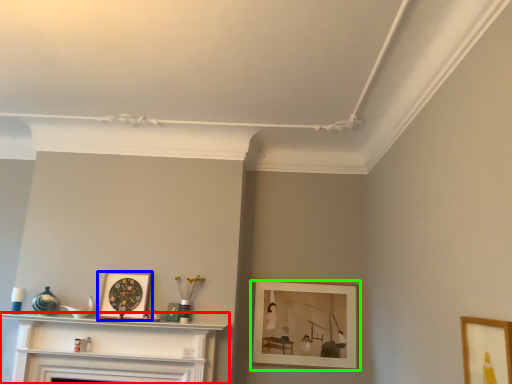
Question: Which object is the closest to the shelf (highlighted by a red box)? Choose among these: picture frame (highlighted by a blue box) or picture frame (highlighted by a green box).

Choices:
 (A) picture frame
 (B) picture frame

Answer: (A)